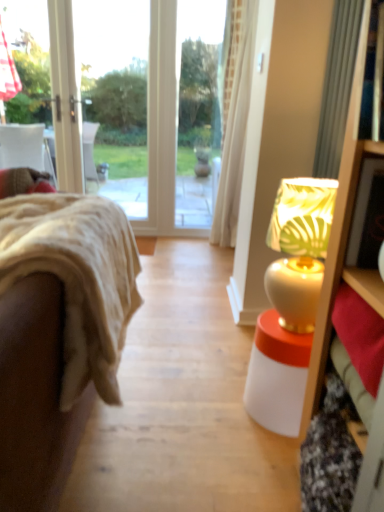
Where is `velvet beige couch at left`? The image size is (384, 512). velvet beige couch at left is located at coordinates 57,329.

Image resolution: width=384 pixels, height=512 pixels. What do you see at coordinates (57, 329) in the screenshot?
I see `velvet beige couch at left` at bounding box center [57, 329].

Measure the distance between point (293, 283) and camera.

Point (293, 283) is 1.37 meters from camera.

The width and height of the screenshot is (384, 512). Describe the element at coordinates (299, 249) in the screenshot. I see `white glossy table lamp at right` at that location.

Find the location of `white glossy table lamp at right`. white glossy table lamp at right is located at coordinates (299, 249).

The height and width of the screenshot is (512, 384). Identify the location of velvet beige couch at left. (57, 329).

Between velvet beige couch at left and white glossy table lamp at right, which one appears on the left side from the viewer's perspective?

velvet beige couch at left is more to the left.

Considering the positions of objects velvet beige couch at left and white glossy table lamp at right in the image provided, who is behind, velvet beige couch at left or white glossy table lamp at right?

white glossy table lamp at right is further away from the camera.

Is point (22, 263) farther from camera compared to point (309, 199)?

That is False.

From the image's perspective, does velvet beige couch at left appear lower than white glossy table lamp at right?

Yes.

From a real-world perspective, who is located higher, velvet beige couch at left or white glossy table lamp at right?

white glossy table lamp at right.

Which object is wider, velvet beige couch at left or white glossy table lamp at right?

velvet beige couch at left.

In terms of height, does velvet beige couch at left look taller or shorter compared to white glossy table lamp at right?

In the image, velvet beige couch at left appears to be shorter than white glossy table lamp at right.

Based on the photo, is velvet beige couch at left bigger or smaller than white glossy table lamp at right?

Considering their sizes, velvet beige couch at left takes up more space than white glossy table lamp at right.

From the picture: Is velvet beige couch at left completely or partially outside of white glossy table lamp at right?

Yes, velvet beige couch at left is located beyond the bounds of white glossy table lamp at right.

Is velvet beige couch at left in contact with white glossy table lamp at right?

No, velvet beige couch at left is not touching white glossy table lamp at right.

Is velvet beige couch at left oriented away from white glossy table lamp at right?

Correct, velvet beige couch at left is looking away from white glossy table lamp at right.

Can you tell me how much velvet beige couch at left and white glossy table lamp at right differ in facing direction?

The angular difference between velvet beige couch at left and white glossy table lamp at right is 0.115 degrees.

The image size is (384, 512). What are the coordinates of `table lamp on the right side of velvet beige couch at left` in the screenshot? It's located at (299, 249).

Considering the positions of objects white glossy table lamp at right and velvet beige couch at left in the image provided, who is more to the right, white glossy table lamp at right or velvet beige couch at left?

Positioned to the right is white glossy table lamp at right.

Between white glossy table lamp at right and velvet beige couch at left, which one is positioned behind?

white glossy table lamp at right is further away from the camera.

Is point (297, 298) positioned before point (80, 222)?

No, it is behind (80, 222).

From the image's perspective, which object appears higher, white glossy table lamp at right or velvet beige couch at left?

white glossy table lamp at right appears higher in the image.

From a real-world perspective, who is located higher, white glossy table lamp at right or velvet beige couch at left?

white glossy table lamp at right.

Does white glossy table lamp at right have a lesser width compared to velvet beige couch at left?

→ Correct, the width of white glossy table lamp at right is less than that of velvet beige couch at left.

Can you confirm if white glossy table lamp at right is shorter than velvet beige couch at left?

In fact, white glossy table lamp at right may be taller than velvet beige couch at left.

Who is smaller, white glossy table lamp at right or velvet beige couch at left?

white glossy table lamp at right.

Is white glossy table lamp at right situated inside velvet beige couch at left or outside?

white glossy table lamp at right is not enclosed by velvet beige couch at left.

Can you see white glossy table lamp at right touching velvet beige couch at left?

white glossy table lamp at right and velvet beige couch at left are not in contact.

Does white glossy table lamp at right turn towards velvet beige couch at left?

Yes, white glossy table lamp at right is facing velvet beige couch at left.

How many degrees apart are the facing directions of white glossy table lamp at right and velvet beige couch at left?

The angle between the facing direction of white glossy table lamp at right and the facing direction of velvet beige couch at left is 0.115 degrees.

How far apart are white glossy table lamp at right and velvet beige couch at left?

white glossy table lamp at right is 25.11 inches from velvet beige couch at left.

The width and height of the screenshot is (384, 512). I want to click on studio couch below the white glossy table lamp at right (from the image's perspective), so tap(57, 329).

Locate an element on the screen. The image size is (384, 512). table lamp on the right side of velvet beige couch at left is located at coordinates (299, 249).

This screenshot has height=512, width=384. What are the coordinates of `table lamp that appears above the velvet beige couch at left (from the image's perspective)` in the screenshot? It's located at (299, 249).